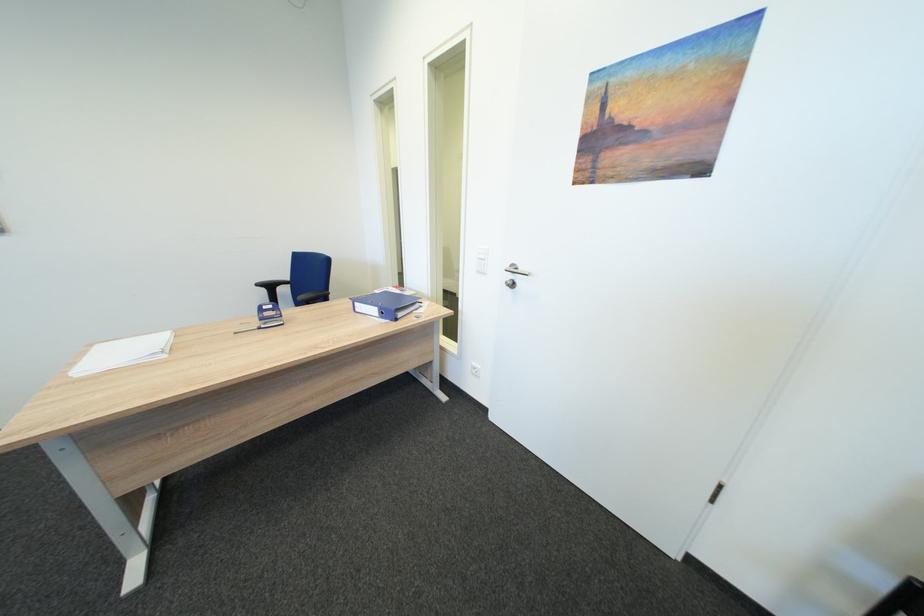
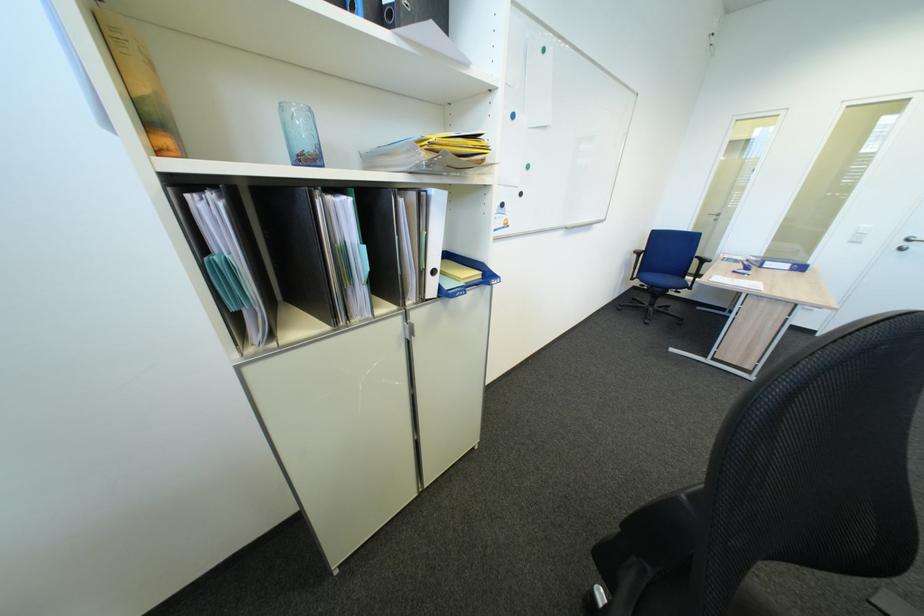
In the second image, find the point that corresponds to [367,305] in the first image.

(776, 264)